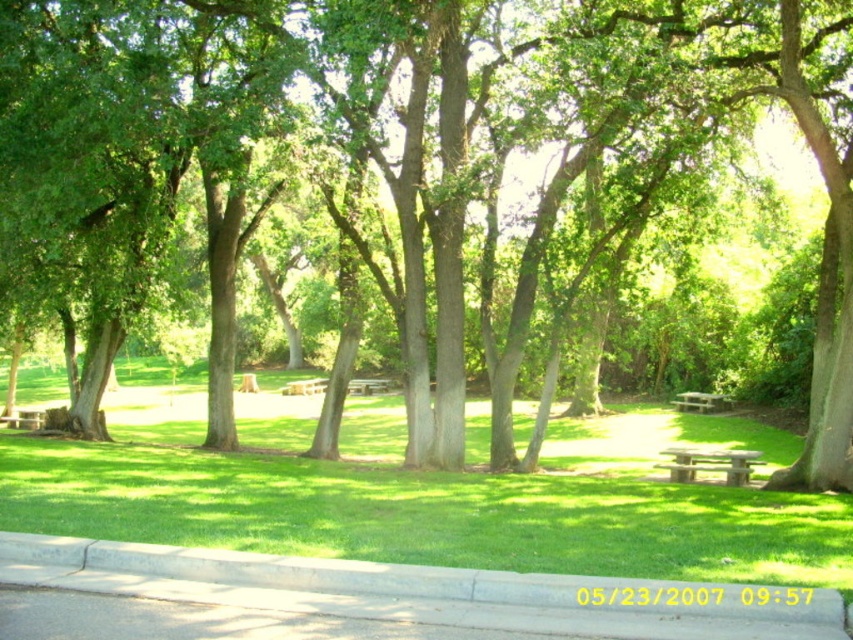
Question: Which object is farther from the camera taking this photo?

Choices:
 (A) wooden picnic table at center
 (B) green grassy at center
 (C) gray concrete curb at lower center

Answer: (A)

Question: Which point is closer to the camera?

Choices:
 (A) wooden picnic table at center
 (B) green wooden bench at center

Answer: (A)

Question: Can you confirm if gray concrete curb at lower center is positioned to the right of green wooden bench at center?

Choices:
 (A) yes
 (B) no

Answer: (A)

Question: Which point is closer to the camera taking this photo?

Choices:
 (A) (679, 460)
 (B) (485, 531)

Answer: (B)

Question: Does gray concrete curb at lower center lie behind wooden park bench at center?

Choices:
 (A) no
 (B) yes

Answer: (A)

Question: From the image, what is the correct spatial relationship of gray concrete curb at lower center in relation to wooden picnic table at center?

Choices:
 (A) above
 (B) below

Answer: (A)